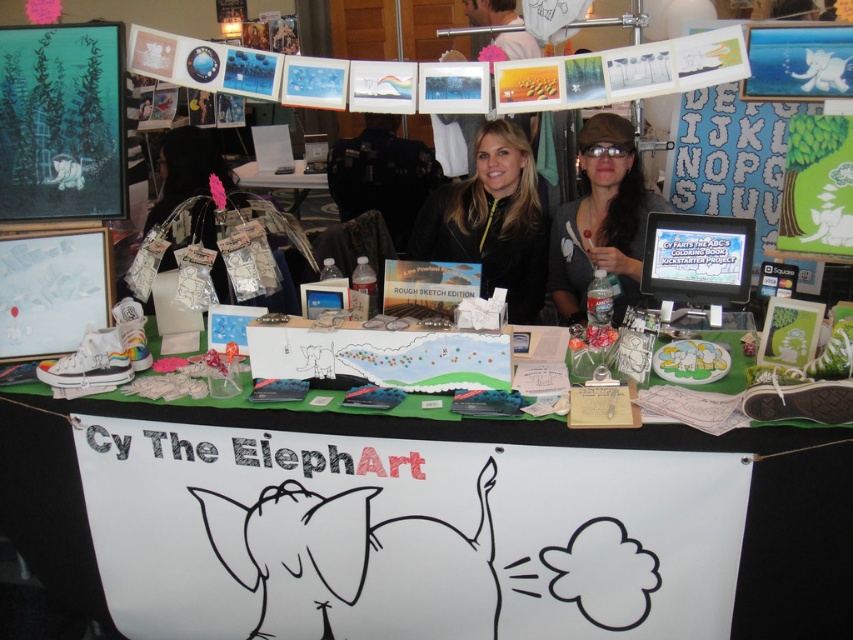
Is teal matte painting at upper left taller than matte black cap at center?

No, teal matte painting at upper left is not taller than matte black cap at center.

Is point (102, 61) more distant than point (637, 157)?

That is False.

The width and height of the screenshot is (853, 640). What are the coordinates of `teal matte painting at upper left` in the screenshot? It's located at (62, 122).

Is matte black jacket at center below matte white paper at center?

Correct, matte black jacket at center is located below matte white paper at center.

Consider the image. Can you confirm if matte black jacket at center is smaller than matte white paper at center?

Yes.

Is point (473, 209) positioned behind point (194, 211)?

Yes.

Where is `matte black jacket at center`? The height and width of the screenshot is (640, 853). matte black jacket at center is located at coordinates (492, 220).

Does teal matte painting at upper left have a larger size compared to matte black monitor at right?

Yes, teal matte painting at upper left is bigger than matte black monitor at right.

Is teal matte painting at upper left closer to the viewer compared to matte black monitor at right?

No, teal matte painting at upper left is further to the viewer.

The image size is (853, 640). What do you see at coordinates (62, 122) in the screenshot? I see `teal matte painting at upper left` at bounding box center [62, 122].

Locate an element on the screen. teal matte painting at upper left is located at coordinates pos(62,122).